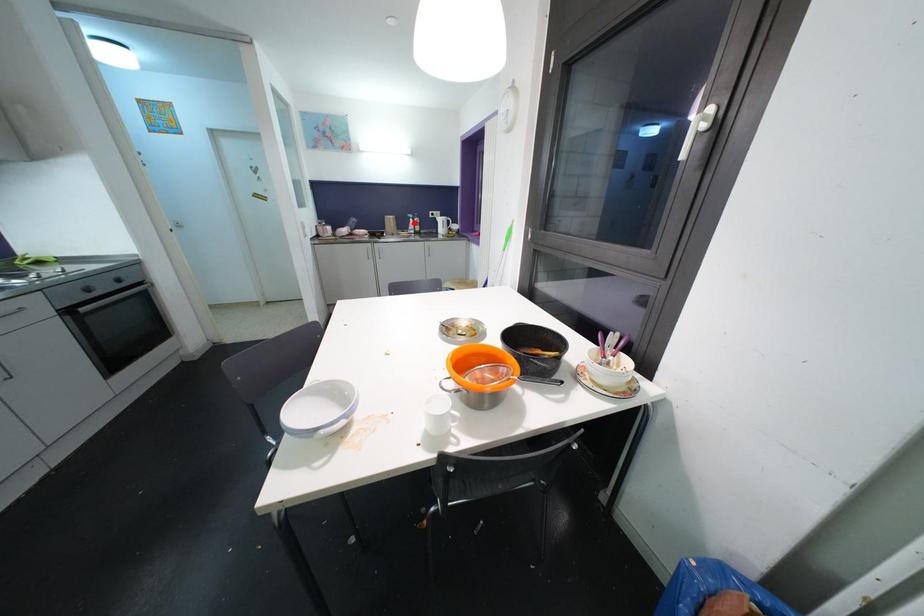
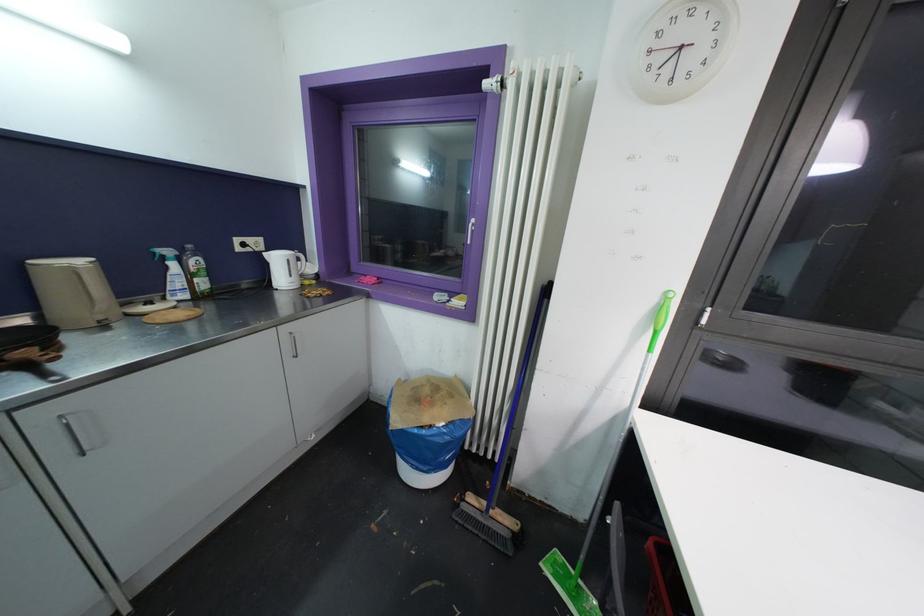
In the second image, find the point that corresponds to the highlighted location in the first image.

(176, 267)